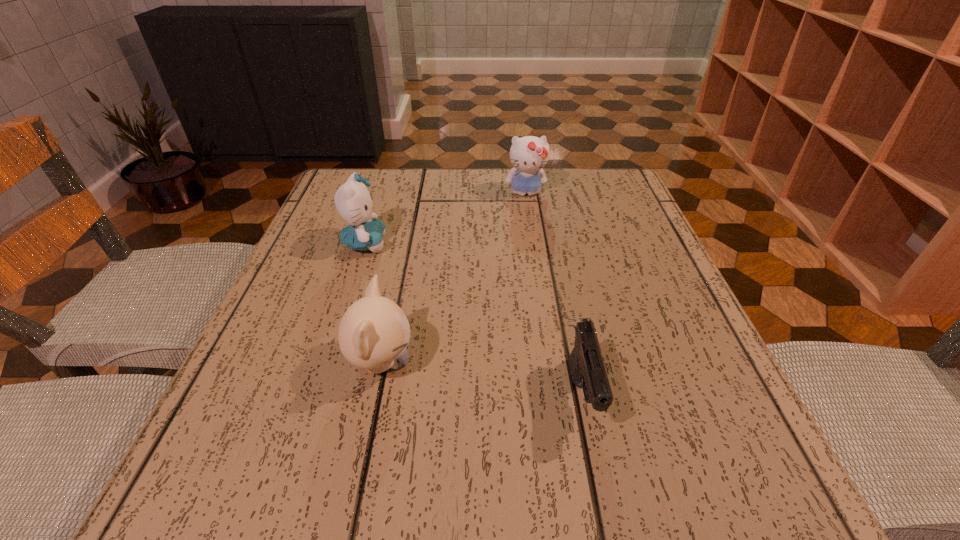
You are a GUI agent. You are given a task and a screenshot of the screen. Output one action in this format:
    pyautogui.click(x=<x>, y=<y>)
    Task: Click on the free space between the rightmost kitten and the pistol
    
    Given the screenshot: What is the action you would take?
    pyautogui.click(x=554, y=295)

In order to click on object identified as the closest to the second farthest kitten in this screenshot , I will do `click(374, 332)`.

Locate which object is the third closest to the nearest kitten. Please provide its 2D coordinates. Your answer should be formatted as a tuple, i.e. [(x, y)], where the tuple contains the x and y coordinates of a point satisfying the conditions above.

[(529, 154)]

This screenshot has width=960, height=540. Identify the location of kitten that can be found as the closest to the shortest object. (374, 332).

Locate an element on the screen. kitten that is the third closest to the pistol is located at coordinates (529, 154).

This screenshot has height=540, width=960. Identify the location of vacant space that satisfies the following two spatial constraints: 1. on the front-facing side of the farthest object; 2. on the face of the second farthest kitten. (533, 244).

Find the location of a particular element. The height and width of the screenshot is (540, 960). vacant area that satisfies the following two spatial constraints: 1. on the front-facing side of the rightmost kitten; 2. on the face of the second farthest kitten is located at coordinates (533, 244).

Identify the location of blank area in the image that satisfies the following two spatial constraints: 1. on the front-facing side of the rightmost kitten; 2. on the face of the third nearest object. (533, 244).

Locate an element on the screen. The height and width of the screenshot is (540, 960). free spot that satisfies the following two spatial constraints: 1. on the front-facing side of the rightmost kitten; 2. on the face of the nearest kitten is located at coordinates point(551,363).

Where is `free location that satisfies the following two spatial constraints: 1. on the front-facing side of the farthest kitten; 2. on the face of the second farthest object`? free location that satisfies the following two spatial constraints: 1. on the front-facing side of the farthest kitten; 2. on the face of the second farthest object is located at coordinates (533, 244).